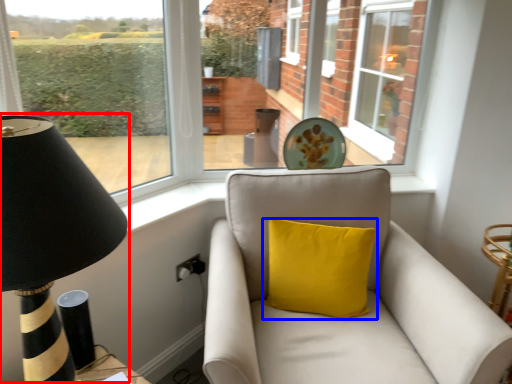
Question: Which object appears closest to the camera in this image, table lamp (highlighted by a red box) or pillow (highlighted by a blue box)?

Choices:
 (A) table lamp
 (B) pillow

Answer: (A)